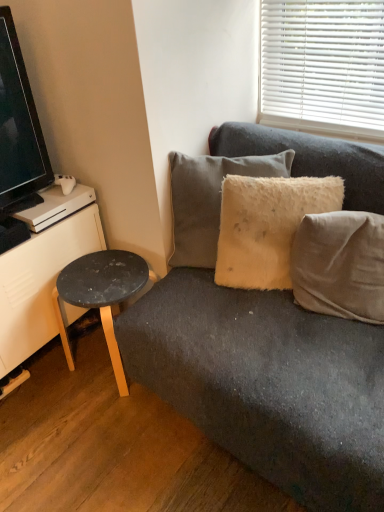
Question: Is black glossy tv at left thinner than black laminate stool at lower left?

Choices:
 (A) no
 (B) yes

Answer: (B)

Question: Considering the relative sizes of black glossy tv at left and black laminate stool at lower left in the image provided, is black glossy tv at left bigger than black laminate stool at lower left?

Choices:
 (A) yes
 (B) no

Answer: (B)

Question: Considering the relative positions of black glossy tv at left and black laminate stool at lower left in the image provided, is black glossy tv at left in front of black laminate stool at lower left?

Choices:
 (A) yes
 (B) no

Answer: (A)

Question: From a real-world perspective, does black glossy tv at left sit lower than black laminate stool at lower left?

Choices:
 (A) no
 (B) yes

Answer: (A)

Question: Would you say black glossy tv at left contains black laminate stool at lower left?

Choices:
 (A) no
 (B) yes

Answer: (A)

Question: Considering the positions of black glossy tv at left and beige cotton cushion at right, the 3th pillow viewed from the left, in the image, is black glossy tv at left taller or shorter than beige cotton cushion at right, the 3th pillow viewed from the left,?

Choices:
 (A) short
 (B) tall

Answer: (B)

Question: In terms of width, does black glossy tv at left look wider or thinner when compared to beige cotton cushion at right, acting as the 1th pillow starting from the right?

Choices:
 (A) wide
 (B) thin

Answer: (B)

Question: From a real-world perspective, relative to beige cotton cushion at right, acting as the 1th pillow starting from the right, is black glossy tv at left vertically above or below?

Choices:
 (A) above
 (B) below

Answer: (A)

Question: Which is correct: black glossy tv at left is inside beige cotton cushion at right, the 3th pillow viewed from the left, or outside of it?

Choices:
 (A) inside
 (B) outside

Answer: (B)

Question: In the image, is beige cotton cushion at right, the 3th pillow viewed from the left, on the left side or the right side of fuzzy beige pillow at upper right, which is the third pillow in right-to-left order?

Choices:
 (A) left
 (B) right

Answer: (B)

Question: From the image's perspective, is beige cotton cushion at right, the 3th pillow viewed from the left, above or below fuzzy beige pillow at upper right, which is the third pillow in right-to-left order?

Choices:
 (A) above
 (B) below

Answer: (B)

Question: Is beige cotton cushion at right, the 3th pillow viewed from the left, taller or shorter than fuzzy beige pillow at upper right, marked as the 1th pillow in a left-to-right arrangement?

Choices:
 (A) tall
 (B) short

Answer: (B)

Question: From a real-world perspective, is beige cotton cushion at right, the 3th pillow viewed from the left, above or below fuzzy beige pillow at upper right, which is the third pillow in right-to-left order?

Choices:
 (A) below
 (B) above

Answer: (A)

Question: In terms of size, does fuzzy beige pillow at upper right, which is the third pillow in right-to-left order, appear bigger or smaller than black laminate stool at lower left?

Choices:
 (A) big
 (B) small

Answer: (B)

Question: Is point (175, 241) closer or farther from the camera than point (110, 355)?

Choices:
 (A) farther
 (B) closer

Answer: (A)